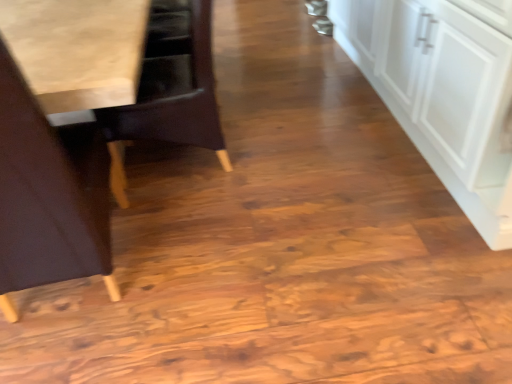
I want to click on vacant space to the right of wooden chair at left, positioned as the first chair in back-to-front order, so click(x=281, y=153).